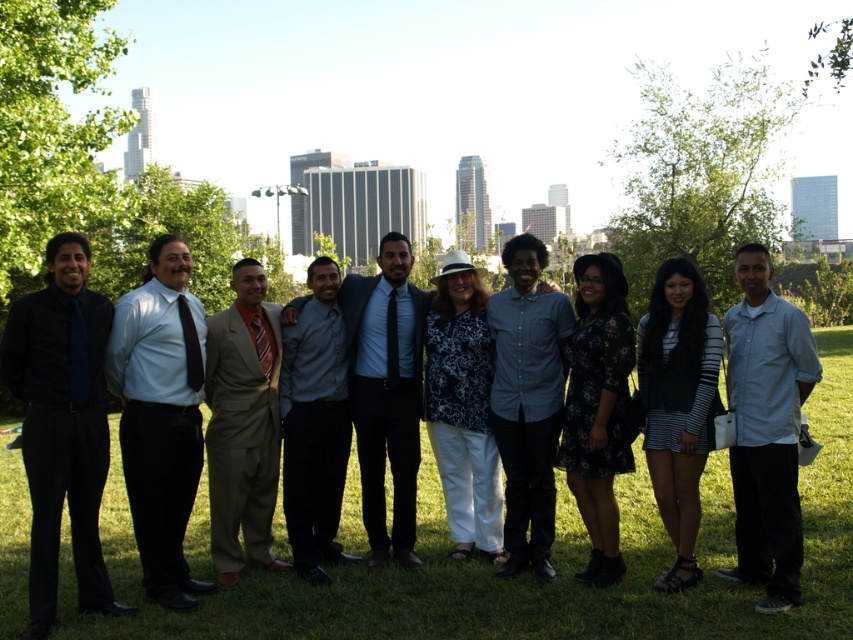
Question: Can you confirm if dark blue suit at center is bigger than denim shirt at center?

Choices:
 (A) yes
 (B) no

Answer: (A)

Question: Which object is farther from the camera taking this photo?

Choices:
 (A) matte blue shirt at center
 (B) denim shirt at center
 (C) light blue shirt at center

Answer: (B)

Question: Which of the following is the farthest from the observer?

Choices:
 (A) (688, 349)
 (B) (351, 403)
 (C) (703, 627)

Answer: (B)

Question: Based on their relative distances, which object is farther from the striped fabric dress at center?

Choices:
 (A) light blue shirt at center
 (B) dark blue suit at center
 (C) tan suit at center

Answer: (C)

Question: From the image, what is the correct spatial relationship of matte black shirt at left in relation to gray matte shirt at center?

Choices:
 (A) right
 (B) left

Answer: (B)

Question: Where is matte black suit at center located in relation to matte blue shirt at center in the image?

Choices:
 (A) above
 (B) below

Answer: (B)